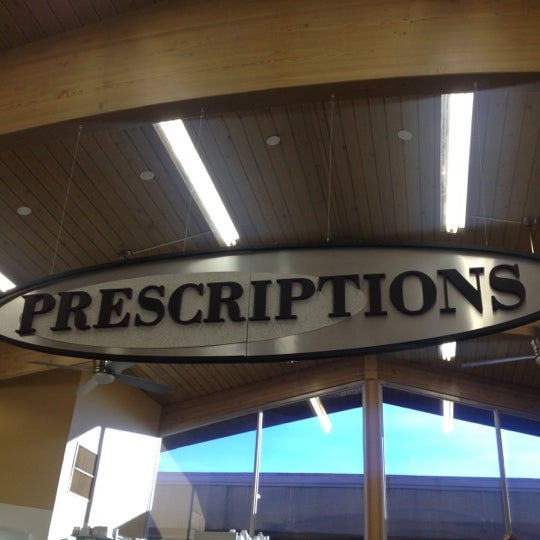
Locate an element on the screen. This screenshot has width=540, height=540. window supports is located at coordinates (255, 471), (504, 484).